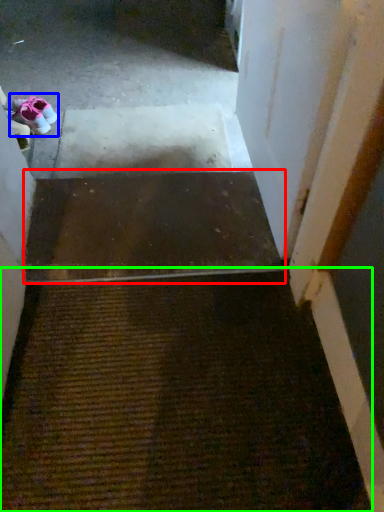
Question: Considering the real-world distances, which object is closest to stairs (highlighted by a red box)? footwear (highlighted by a blue box) or doormat (highlighted by a green box).

Choices:
 (A) footwear
 (B) doormat

Answer: (B)